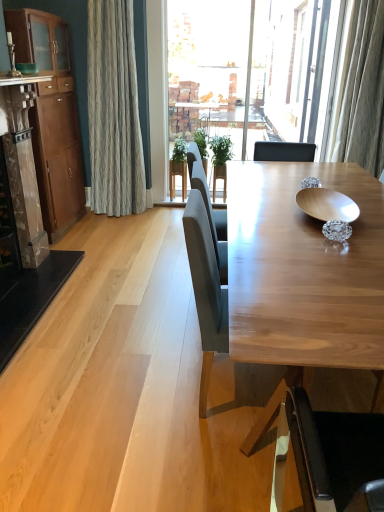
Question: Considering the positions of green leafy plant at center and matte wood counter top at upper left in the image, is green leafy plant at center taller or shorter than matte wood counter top at upper left?

Choices:
 (A) short
 (B) tall

Answer: (B)

Question: Do you think green leafy plant at center is within matte wood counter top at upper left, or outside of it?

Choices:
 (A) outside
 (B) inside

Answer: (A)

Question: Considering the real-world distances, which object is farthest from the matte gray chair at center, the second chair viewed from the front?

Choices:
 (A) matte wood counter top at upper left
 (B) wooden bowl at center
 (C) brown wood cabinet at left
 (D) light brown wood chair at center, acting as the 2th chair starting from the back
 (E) marble fireplace at left

Answer: (C)

Question: Which object is positioned farthest from the brown wood cabinet at left?

Choices:
 (A) marble fireplace at left
 (B) green leafy plant at center
 (C) matte wood counter top at upper left
 (D) matte gray chair at center, the 1th chair viewed from the back
 (E) wooden bowl at center

Answer: (E)